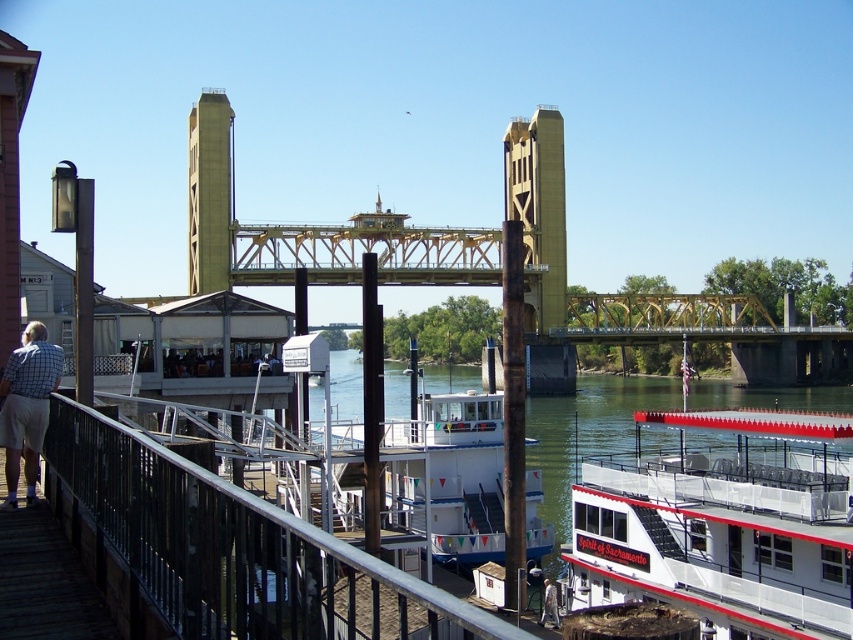
How much distance is there between metallic silver railing at lower left and yellow metallic bridge at center?

metallic silver railing at lower left is 159.66 meters from yellow metallic bridge at center.

Does metallic silver railing at lower left have a greater height compared to yellow metallic bridge at center?

No.

Locate an element on the screen. This screenshot has width=853, height=640. metallic silver railing at lower left is located at coordinates (238, 548).

Is metallic silver railing at lower left bigger than checkered shirt at left?

Yes, metallic silver railing at lower left is bigger than checkered shirt at left.

Between metallic silver railing at lower left and checkered shirt at left, which one appears on the right side from the viewer's perspective?

Positioned to the right is metallic silver railing at lower left.

Which is behind, point (229, 552) or point (42, 394)?

Positioned behind is point (42, 394).

You are a GUI agent. You are given a task and a screenshot of the screen. Output one action in this format:
    pyautogui.click(x=<x>, y=<y>)
    Task: Click on the metallic silver railing at lower left
    
    Given the screenshot: What is the action you would take?
    pyautogui.click(x=238, y=548)

Is point (393, 532) behind point (19, 397)?

That is True.

From the picture: Between white matte boat at center and checkered shirt at left, which one appears on the left side from the viewer's perspective?

checkered shirt at left is more to the left.

Who is more distant from viewer, [337,419] or [38,397]?

The point [337,419] is more distant.

Identify the location of white matte boat at center. (445, 477).